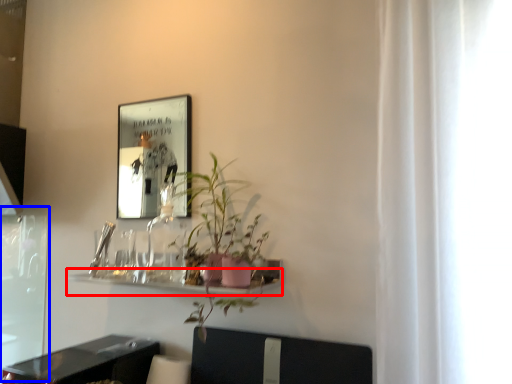
Question: Which object is further to the camera taking this photo, shelf (highlighted by a red box) or screen door (highlighted by a blue box)?

Choices:
 (A) shelf
 (B) screen door

Answer: (B)